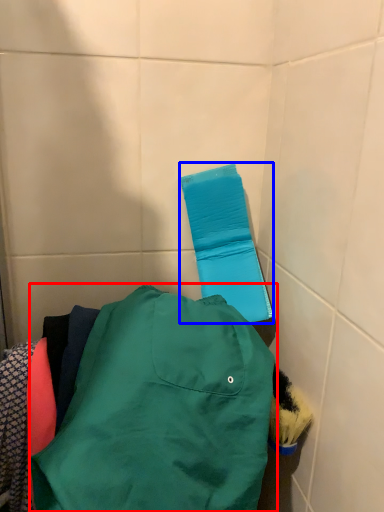
Question: Which of the following is the farthest to the observer, jacket (highlighted by a red box) or towel bar (highlighted by a blue box)?

Choices:
 (A) jacket
 (B) towel bar

Answer: (B)